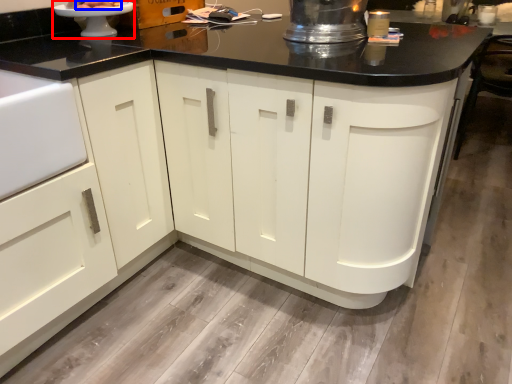
Question: Which point is further to the camera, appliance (highlighted by a red box) or food (highlighted by a blue box)?

Choices:
 (A) appliance
 (B) food

Answer: (B)